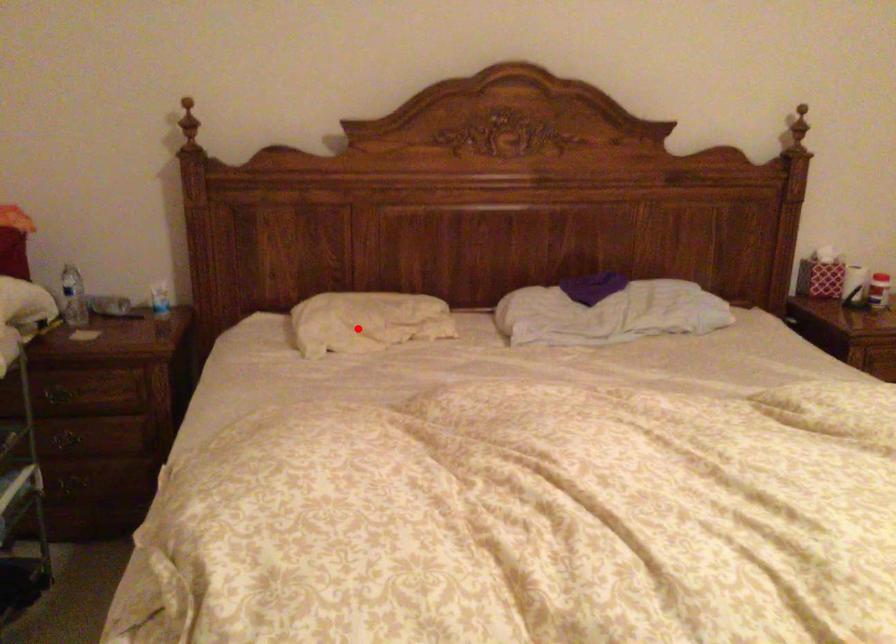
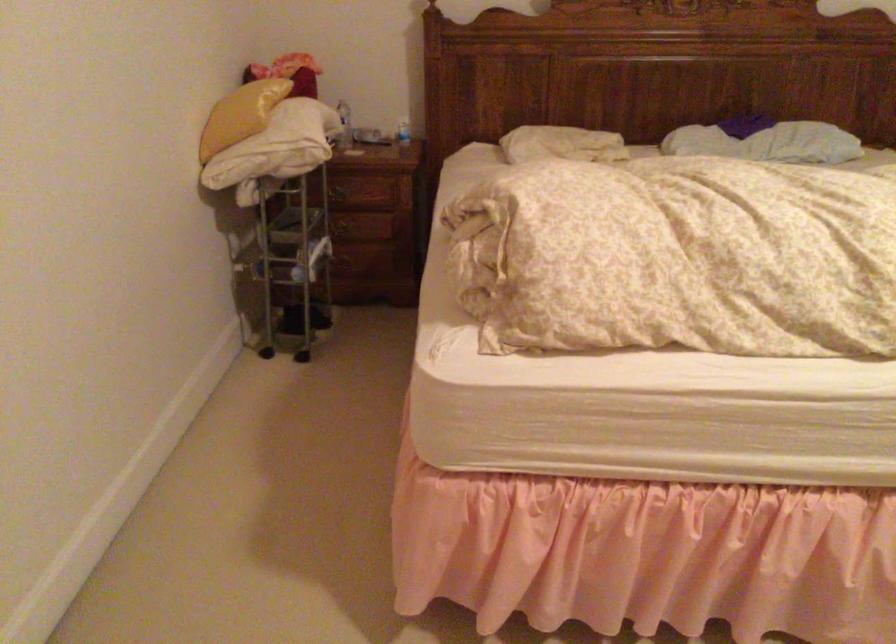
Where in the second image is the point corresponding to the highlighted location from the first image?

(561, 144)